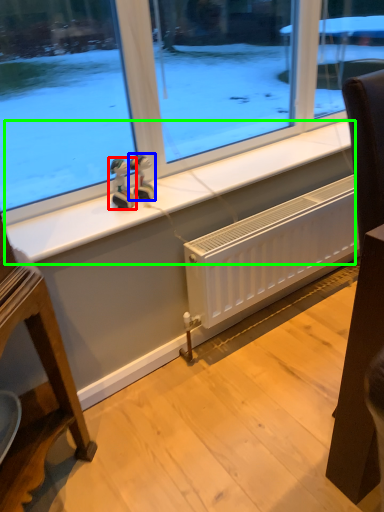
Question: Based on their relative distances, which object is nearer to figurine (highlighted by a red box)? Choose from figurine (highlighted by a blue box) and window sill (highlighted by a green box).

Choices:
 (A) figurine
 (B) window sill

Answer: (A)